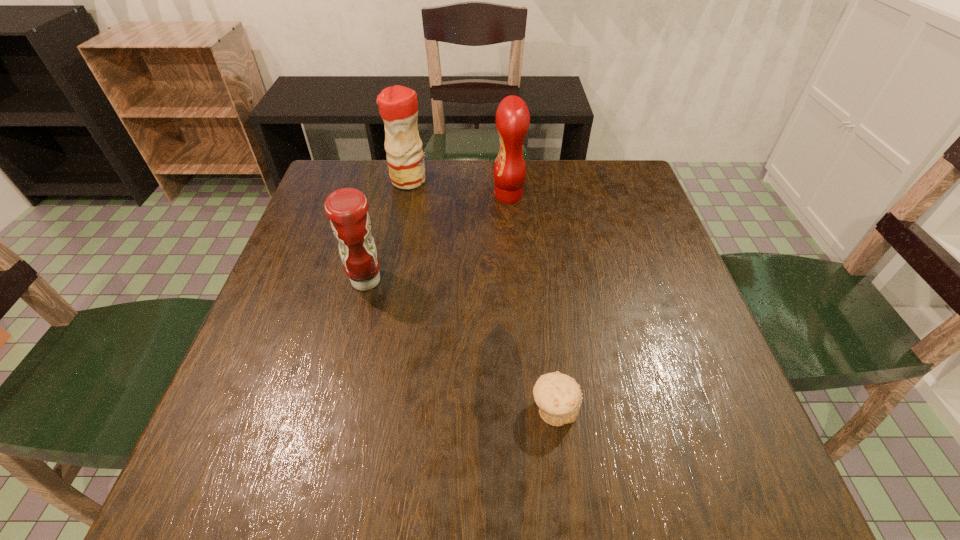
Identify the location of the rightmost condiment. The width and height of the screenshot is (960, 540). (512, 116).

Find the location of a particular element. The image size is (960, 540). the second nearest object is located at coordinates (347, 208).

Where is `the nearest condiment`? the nearest condiment is located at coordinates (347, 208).

At what (x,y) coordinates should I click in order to perform the action: click on the shortest object. Please return your answer as a coordinate pair (x, y). This screenshot has width=960, height=540. Looking at the image, I should click on (558, 396).

The image size is (960, 540). I want to click on the nearest object, so click(x=558, y=396).

Identify the location of free space located on the label side of the rightmost condiment. (471, 195).

Where is `vacant point located on the label side of the rightmost condiment`? vacant point located on the label side of the rightmost condiment is located at coordinates pyautogui.click(x=377, y=195).

This screenshot has height=540, width=960. I want to click on free space located 0.360m on the label side of the rightmost condiment, so click(x=362, y=195).

Identify the location of free space located on the front of the second nearest object. (356, 322).

The image size is (960, 540). Find the location of `free region located on the left of the muffin`. free region located on the left of the muffin is located at coordinates tap(314, 409).